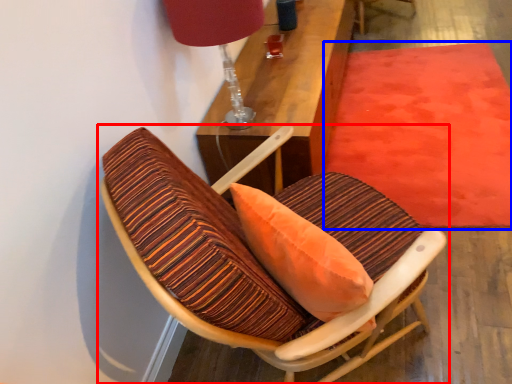
Question: Which point is further to the camera, chair (highlighted by a red box) or mat (highlighted by a blue box)?

Choices:
 (A) chair
 (B) mat

Answer: (B)